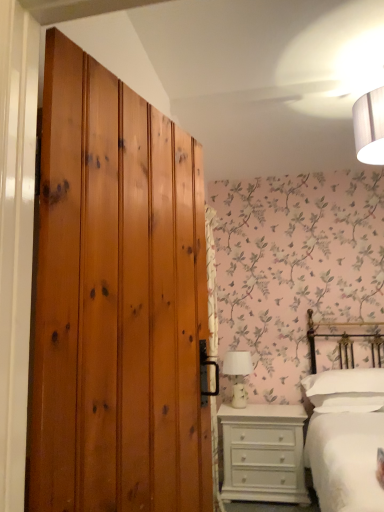
What are the coordinates of `white ceramic table lamp at center` in the screenshot? It's located at (238, 374).

The height and width of the screenshot is (512, 384). Describe the element at coordinates (263, 453) in the screenshot. I see `white painted wood chest of drawers at lower right` at that location.

Measure the distance between white cotton bed at right and camera.

4.77 feet.

Measure the distance between point (374, 503) and camera.

A distance of 4.94 feet exists between point (374, 503) and camera.

This screenshot has height=512, width=384. Describe the element at coordinates (346, 390) in the screenshot. I see `white soft pillow at right` at that location.

In order to click on white ceramic table lamp at center in this screenshot , I will do `click(238, 374)`.

How many degrees apart are the facing directions of white cotton bed at right and white painted wood chest of drawers at lower right?

There is a 1.37-degree angle between the facing directions of white cotton bed at right and white painted wood chest of drawers at lower right.

From a real-world perspective, who is located higher, white cotton bed at right or white painted wood chest of drawers at lower right?

In real-world perspective, white cotton bed at right is above.

This screenshot has width=384, height=512. Find the location of `chest of drawers behind the white cotton bed at right`. chest of drawers behind the white cotton bed at right is located at coordinates (263, 453).

Between white cotton bed at right and white painted wood chest of drawers at lower right, which one has more height?

white cotton bed at right.

Considering the sizes of white painted wood chest of drawers at lower right and white cotton bed at right in the image, is white painted wood chest of drawers at lower right bigger or smaller than white cotton bed at right?

Clearly, white painted wood chest of drawers at lower right is smaller in size than white cotton bed at right.

Considering the relative sizes of white painted wood chest of drawers at lower right and white cotton bed at right in the image provided, is white painted wood chest of drawers at lower right wider than white cotton bed at right?

In fact, white painted wood chest of drawers at lower right might be narrower than white cotton bed at right.

From a real-world perspective, is white painted wood chest of drawers at lower right positioned above or below white cotton bed at right?

Clearly, from a real-world perspective, white painted wood chest of drawers at lower right is below white cotton bed at right.

Is white soft pillow at right not close to white cotton bed at right?

No, white soft pillow at right is not far from white cotton bed at right.

From a real-world perspective, is white soft pillow at right physically below white cotton bed at right?

No.

Is white soft pillow at right bigger than white cotton bed at right?

No.

From the picture: Is white soft pillow at right situated inside white cotton bed at right or outside?

white soft pillow at right fits inside white cotton bed at right.

Between white cotton bed at right and white soft pillow at right, which one has smaller size?

With smaller size is white soft pillow at right.

Which is behind, white cotton bed at right or white soft pillow at right?

white soft pillow at right is further from the camera.

In the scene shown: Is white cotton bed at right aimed at white soft pillow at right?

No, white cotton bed at right is not aimed at white soft pillow at right.

From a real-world perspective, who is located higher, white cotton bed at right or white soft pillow at right?

white soft pillow at right.

Would you say white ceramic table lamp at center is a long distance from white cotton bed at right?

That's not correct — white ceramic table lamp at center is a little close to white cotton bed at right.

This screenshot has width=384, height=512. In order to click on table lamp lying behind the white cotton bed at right in this screenshot , I will do `click(238, 374)`.

From the image's perspective, which object appears higher, white ceramic table lamp at center or white cotton bed at right?

white cotton bed at right is shown above in the image.

Is white soft pillow at right taller than wooden wardrobe at left?

No.

From a real-world perspective, is white soft pillow at right positioned under wooden wardrobe at left based on gravity?

Indeed, from a real-world perspective, white soft pillow at right is positioned beneath wooden wardrobe at left.

Can you confirm if white soft pillow at right is wider than wooden wardrobe at left?

Yes, white soft pillow at right is wider than wooden wardrobe at left.

From the image's perspective, which one is positioned higher, white soft pillow at right or wooden wardrobe at left?

wooden wardrobe at left.

Between point (280, 482) and point (373, 371), which one is positioned behind?

The point (373, 371) is farther.

Is white painted wood chest of drawers at lower right thinner than white soft pillow at right?

Yes, white painted wood chest of drawers at lower right is thinner than white soft pillow at right.

Is white painted wood chest of drawers at lower right turned away from white soft pillow at right?

No.

Is white painted wood chest of drawers at lower right positioned beyond the bounds of white soft pillow at right?

Absolutely, white painted wood chest of drawers at lower right is external to white soft pillow at right.

Find the location of a particular element. Image resolution: width=384 pixels, height=512 pixels. chest of drawers below the white cotton bed at right (from a real-world perspective) is located at coordinates (263, 453).

Locate an element on the screen. The image size is (384, 512). bed on the right of white painted wood chest of drawers at lower right is located at coordinates (345, 426).

When comparing their distances from white cotton bed at right, does wooden wardrobe at left or white soft pillow at right seem further?

wooden wardrobe at left lies further to white cotton bed at right than the other object.

Considering their positions, is white painted wood chest of drawers at lower right positioned further to wooden wardrobe at left than white cotton bed at right?

The object further to wooden wardrobe at left is white painted wood chest of drawers at lower right.

Based on their spatial positions, is white ceramic table lamp at center or white painted wood chest of drawers at lower right closer to white cotton bed at right?

Among the two, white painted wood chest of drawers at lower right is located nearer to white cotton bed at right.

When comparing their distances from white painted wood chest of drawers at lower right, does white ceramic table lamp at center or wooden wardrobe at left seem closer?

white ceramic table lamp at center is closer to white painted wood chest of drawers at lower right.

Estimate the real-world distances between objects in this image. Which object is further from white soft pillow at right, white painted wood chest of drawers at lower right or white cotton bed at right?

Among the two, white painted wood chest of drawers at lower right is located further to white soft pillow at right.

When comparing their distances from white ceramic table lamp at center, does wooden wardrobe at left or white cotton bed at right seem further?

Based on the image, wooden wardrobe at left appears to be further to white ceramic table lamp at center.

Which object lies nearer to the anchor point white soft pillow at right, wooden wardrobe at left or white cotton bed at right?

Among the two, white cotton bed at right is located nearer to white soft pillow at right.

Looking at the image, which one is located closer to wooden wardrobe at left, white soft pillow at right or white ceramic table lamp at center?

white soft pillow at right is positioned closer to the anchor wooden wardrobe at left.

Locate an element on the screen. This screenshot has height=512, width=384. pillow between wooden wardrobe at left and white painted wood chest of drawers at lower right from front to back is located at coordinates (346, 390).

Identify the location of pillow between white cotton bed at right and white painted wood chest of drawers at lower right from front to back. (346, 390).

Locate an element on the screen. This screenshot has height=512, width=384. chest of drawers between white ceramic table lamp at center and white soft pillow at right from left to right is located at coordinates (263, 453).

Identify the location of bed located between wooden wardrobe at left and white ceramic table lamp at center in the depth direction. (345, 426).